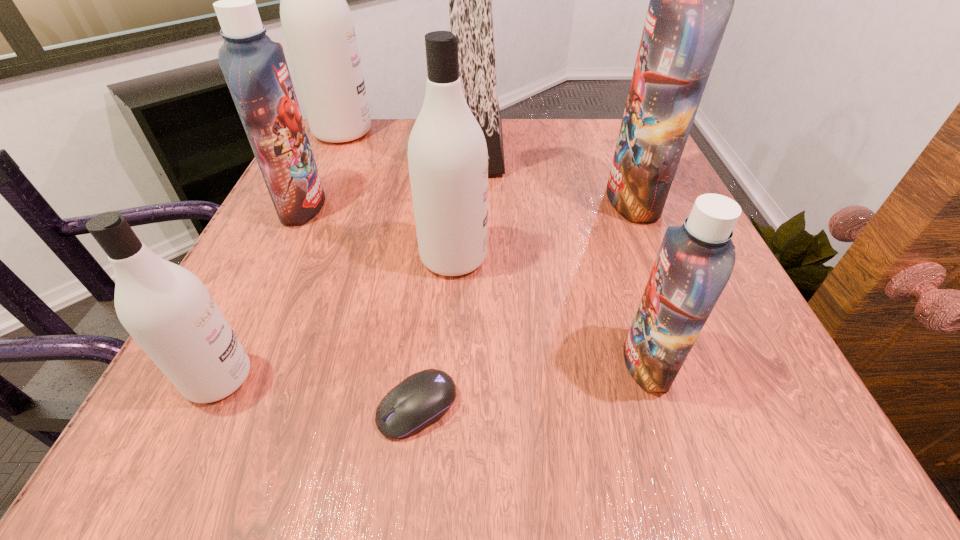
The height and width of the screenshot is (540, 960). What are the coordinates of `shopping bag` in the screenshot? It's located at (470, 0).

The height and width of the screenshot is (540, 960). Identify the location of the farthest shampoo. (317, 23).

Where is `the farthest white shampoo`? This screenshot has height=540, width=960. the farthest white shampoo is located at coordinates (317, 23).

The width and height of the screenshot is (960, 540). I want to click on the biggest blue shampoo, so click(x=691, y=0).

The image size is (960, 540). In order to click on the leftmost blue shampoo in this screenshot , I will do `click(255, 69)`.

This screenshot has height=540, width=960. I want to click on the fifth farthest object, so click(447, 152).

In order to click on the fourth shampoo from left to right in this screenshot , I will do `click(447, 152)`.

This screenshot has width=960, height=540. I want to click on the smallest blue shampoo, so click(695, 261).

The image size is (960, 540). In order to click on the nearest white shampoo in this screenshot , I will do `click(168, 311)`.

What are the coordinates of `black computer mouse` in the screenshot? It's located at (423, 398).